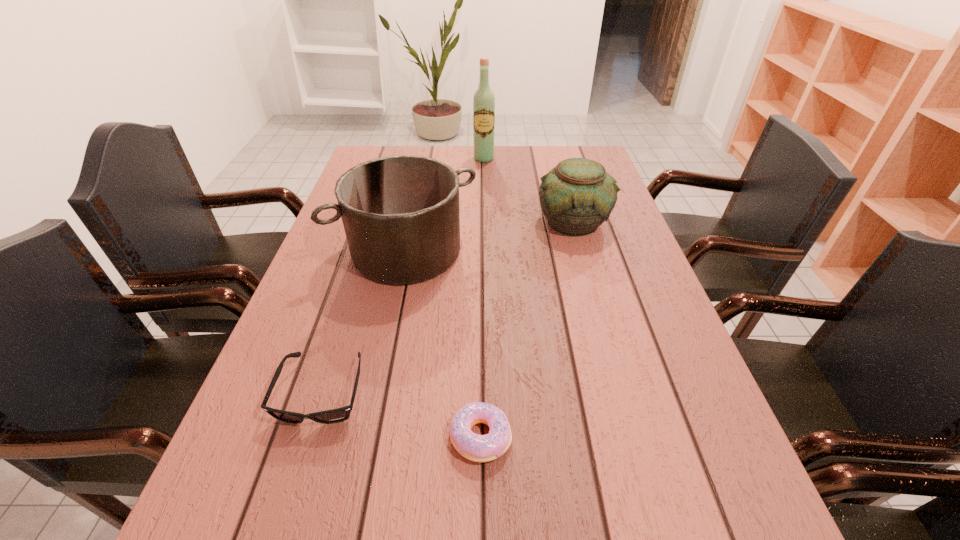
Locate an element on the screen. This screenshot has width=960, height=540. free space that satisfies the following two spatial constraints: 1. on the front-facing side of the pottery; 2. on the left side of the farthest object is located at coordinates (485, 221).

You are a GUI agent. You are given a task and a screenshot of the screen. Output one action in this format:
    pyautogui.click(x=<x>, y=<y>)
    Task: Click on the vacant space that satisfies the following two spatial constraints: 1. on the front side of the shortest object; 2. on the right side of the second tallest object
    The width and height of the screenshot is (960, 540).
    Given the screenshot: What is the action you would take?
    pyautogui.click(x=369, y=437)